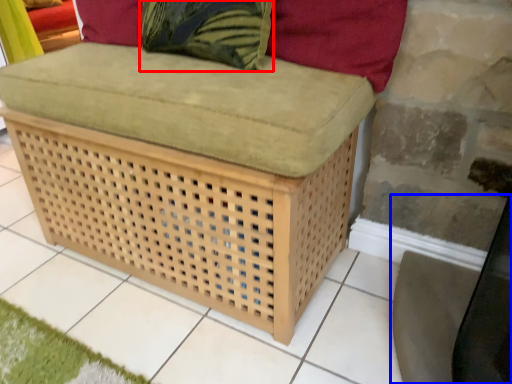
Question: Among these objects, which one is nearest to the camera, throw pillow (highlighted by a red box) or swivel chair (highlighted by a blue box)?

Choices:
 (A) throw pillow
 (B) swivel chair

Answer: (B)